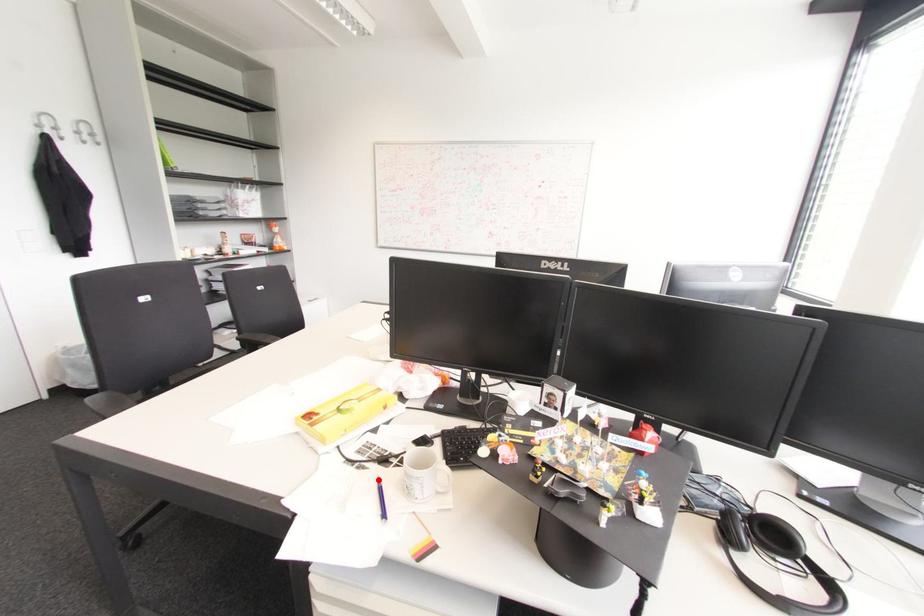
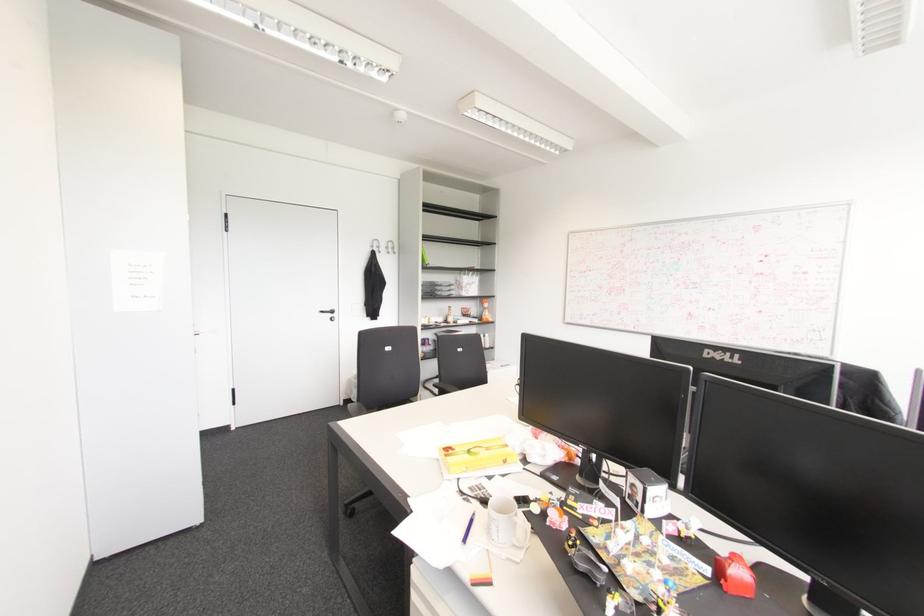
Locate, in the second image, the point that corresponds to the highlighted location in the first image.

(472, 514)